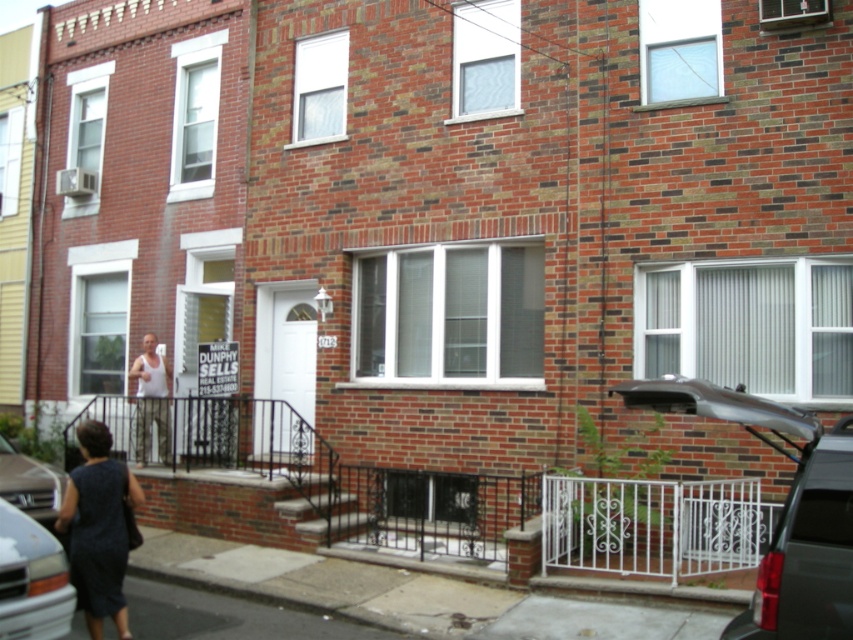
You are a delivery person trying to park your silver metallic van at lower left near the dark gray dress at lower left. The parking space can only accommodate vehicles up to 25 inches in width. Can your van fit in the space if it needs to be parked next to the dress?

The dark gray dress at lower left and silver metallic van at lower left are 24.97 inches apart, so yes, the van can fit in the parking space since the distance between them is within the 25 inches limit.

Consider the image. You are a delivery person arriving at the townhouse to drop off a package. You see a dark gray dress at lower left and a silver metallic van at lower left. Which object is closer to the entrance of the townhouse?

The dark gray dress at lower left is closer to the entrance of the townhouse because it is positioned to the right of the silver metallic van at lower left, which would place it nearer to the entrance if both are at the lower left of the image.

You are standing at the entrance of the townhouse and want to park your car. Where is the matte black car at right located relative to the entrance?

The matte black car at right is located at point [782,509] relative to the entrance.